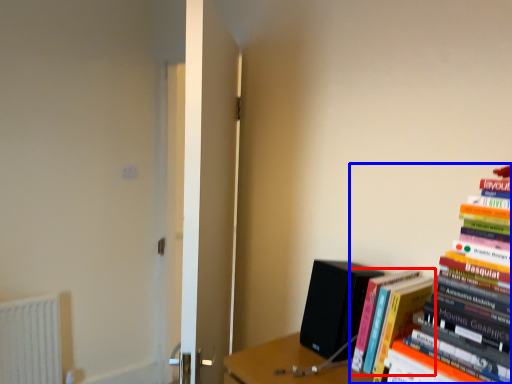
Question: Which object is closer to the camera taking this photo, book (highlighted by a red box) or book (highlighted by a blue box)?

Choices:
 (A) book
 (B) book

Answer: (B)